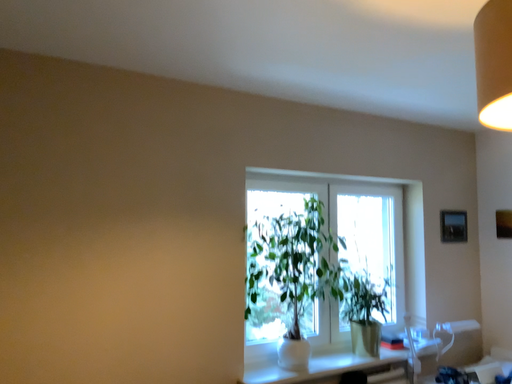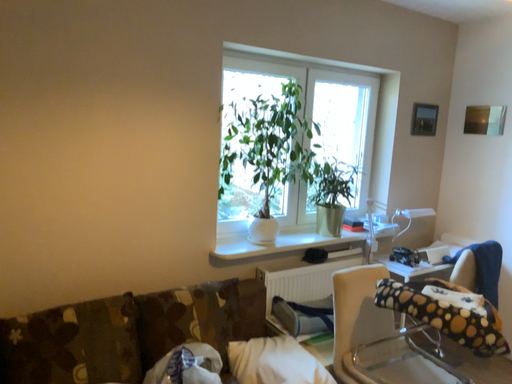
Question: Which way did the camera rotate in the video?

Choices:
 (A) rotated downward
 (B) rotated upward

Answer: (A)